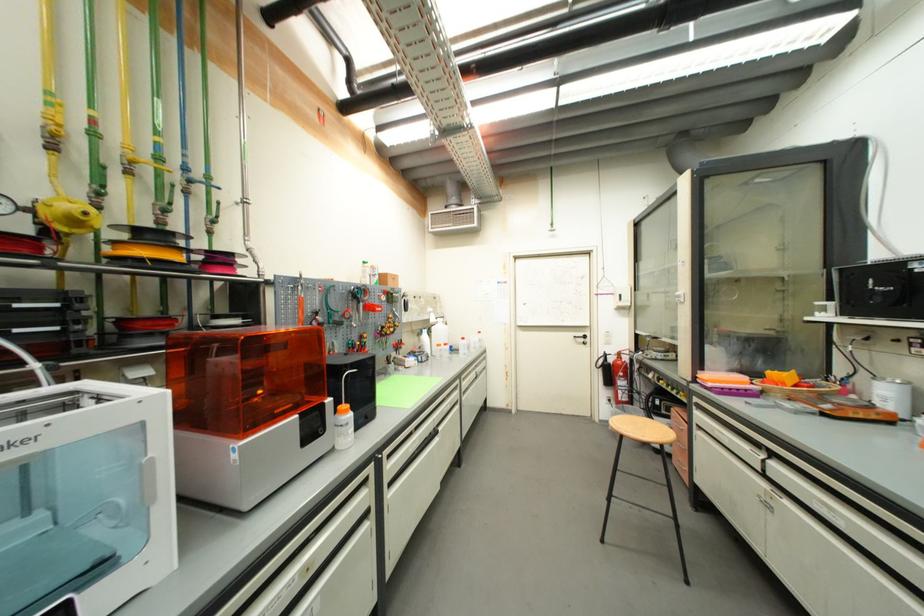
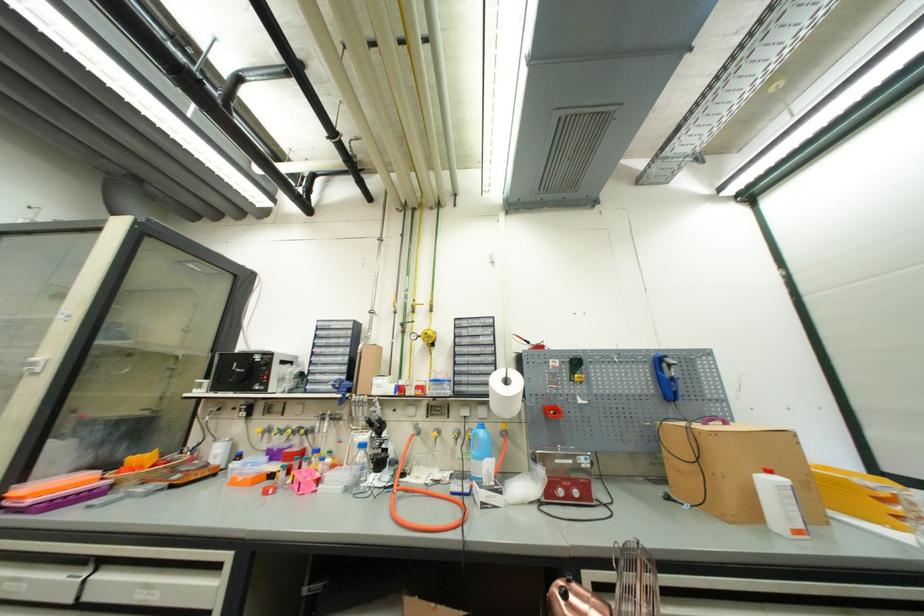
Based on the continuous images, in which direction is the camera rotating?

The rotation direction of the camera is right-up.